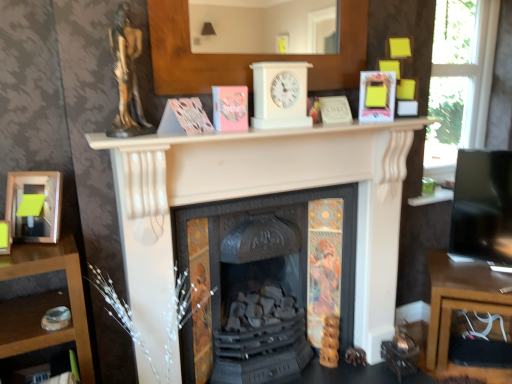
Find the location of a particular element. This screenshot has height=384, width=512. free space that is in between hardcover book at upper right, the fourth paperback book from the left, and matte white book at center, positioned as the third paperback book in left-to-right order is located at coordinates (356, 126).